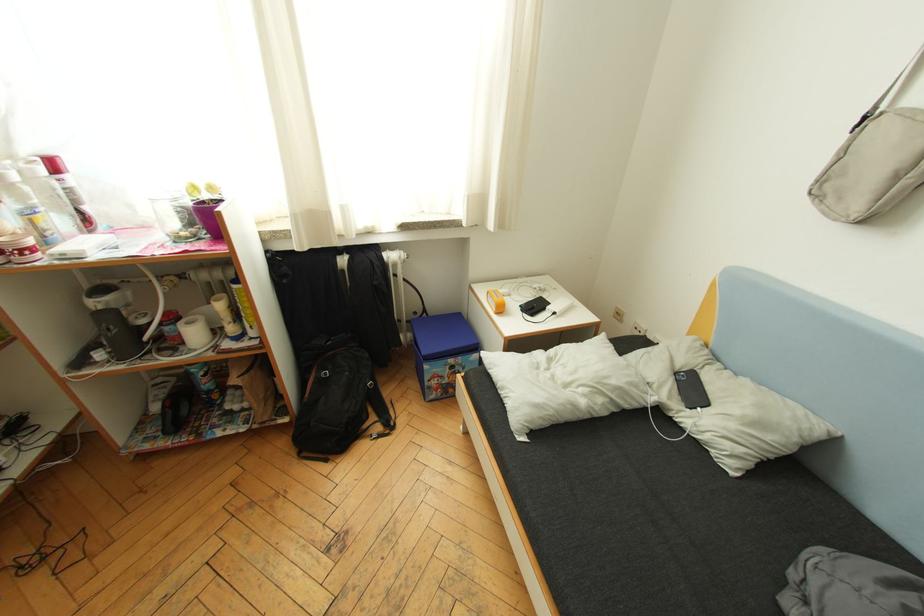
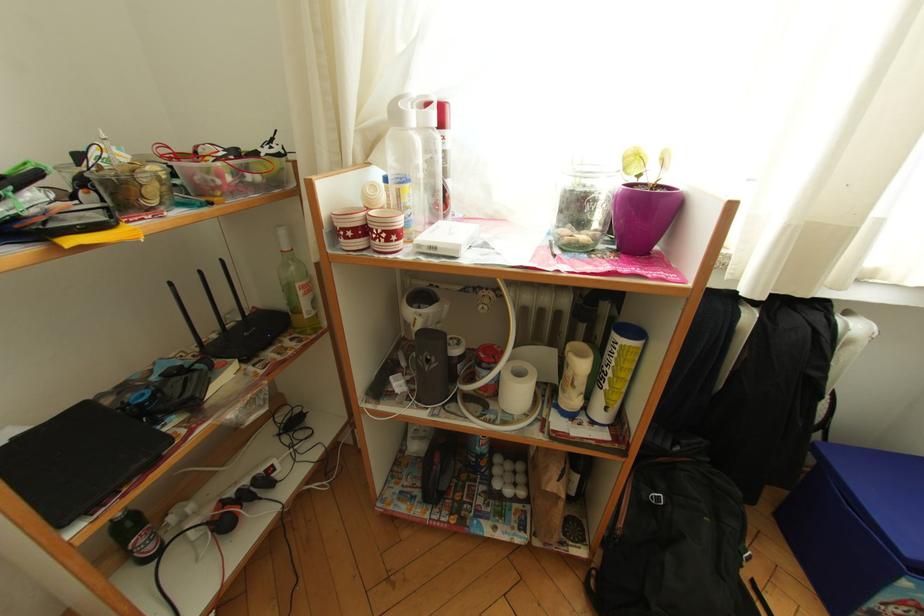
Question: The images are taken continuously from a first-person perspective. In which direction is your viewpoint rotating?

Choices:
 (A) Left
 (B) Right
 (C) Up
 (D) Down

Answer: (A)